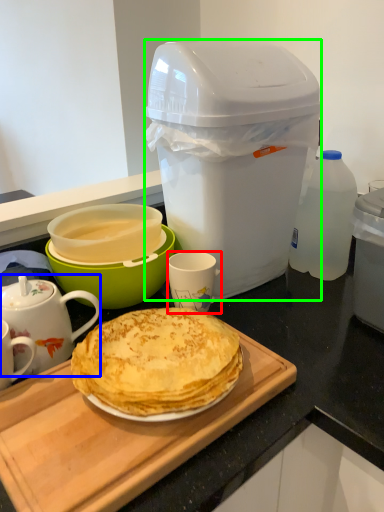
Question: Considering the real-world distances, which object is closest to coffee cup (highlighted by a red box)? teapot (highlighted by a blue box) or trash bin/can (highlighted by a green box).

Choices:
 (A) teapot
 (B) trash bin/can

Answer: (A)